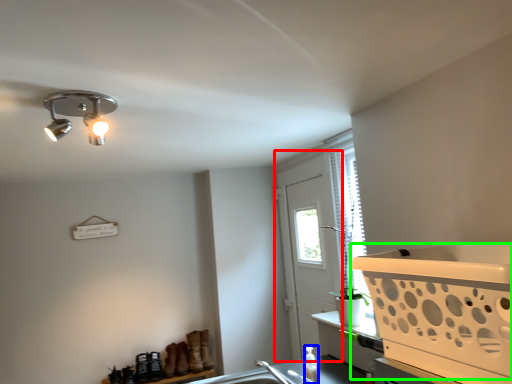
Question: Which object is the farthest from screen door (highlighted by a red box)? Choose among these: bottle (highlighted by a blue box) or basket (highlighted by a green box).

Choices:
 (A) bottle
 (B) basket

Answer: (B)